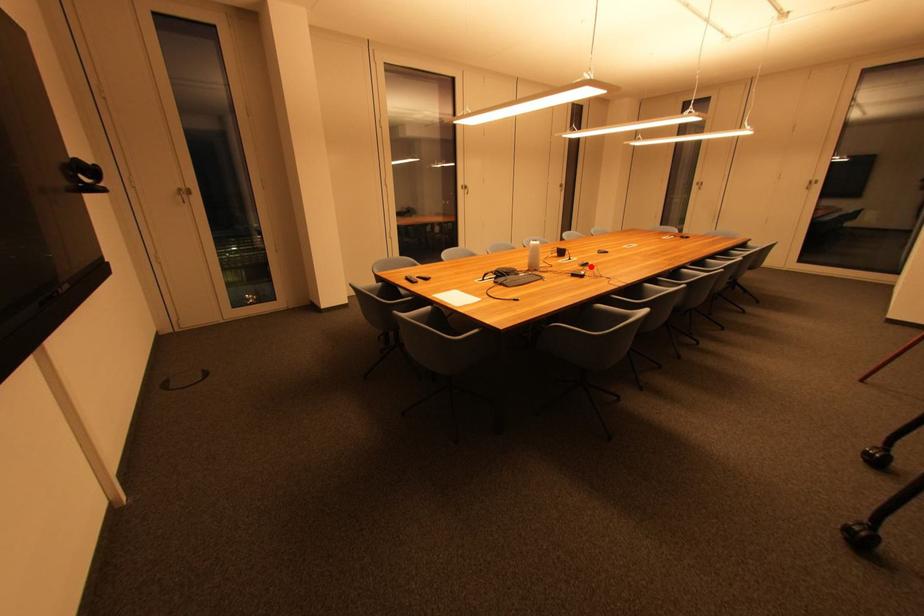
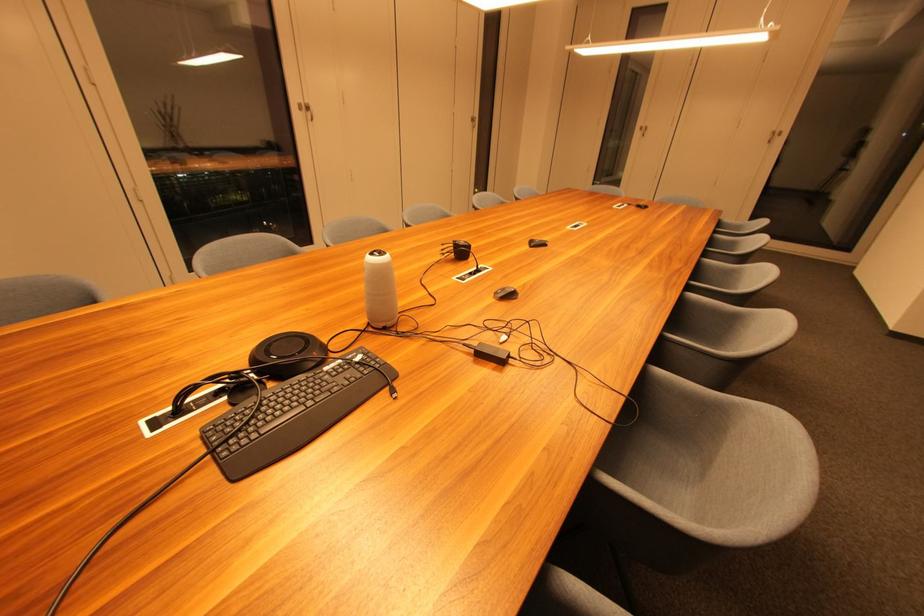
The point at the highlighted location is marked in the first image. Where is the corresponding point in the second image?

(515, 298)